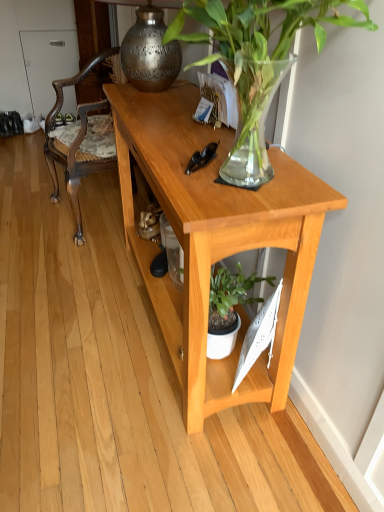
Question: Is green glossy plant at upper center completely or partially outside of polished brass lamp at upper center?

Choices:
 (A) yes
 (B) no

Answer: (A)

Question: Can you confirm if green glossy plant at upper center is positioned to the left of polished brass lamp at upper center?

Choices:
 (A) yes
 (B) no

Answer: (B)

Question: Does green glossy plant at upper center have a lesser width compared to polished brass lamp at upper center?

Choices:
 (A) no
 (B) yes

Answer: (A)

Question: Is green glossy plant at upper center looking in the opposite direction of polished brass lamp at upper center?

Choices:
 (A) yes
 (B) no

Answer: (B)

Question: Is polished brass lamp at upper center located within green glossy plant at upper center?

Choices:
 (A) yes
 (B) no

Answer: (B)

Question: From the image's perspective, is green glossy plant at upper center under polished brass lamp at upper center?

Choices:
 (A) no
 (B) yes

Answer: (B)

Question: From the image's perspective, is wooden carved chair at left under green glossy plant at upper center?

Choices:
 (A) yes
 (B) no

Answer: (B)

Question: Is the depth of wooden carved chair at left less than that of green glossy plant at upper center?

Choices:
 (A) no
 (B) yes

Answer: (A)

Question: Is wooden carved chair at left in contact with green glossy plant at upper center?

Choices:
 (A) yes
 (B) no

Answer: (B)

Question: Does wooden carved chair at left have a smaller size compared to green glossy plant at upper center?

Choices:
 (A) yes
 (B) no

Answer: (B)

Question: From a real-world perspective, is wooden carved chair at left on top of green glossy plant at upper center?

Choices:
 (A) no
 (B) yes

Answer: (A)

Question: From the image's perspective, does wooden carved chair at left appear higher than green glossy plant at upper center?

Choices:
 (A) yes
 (B) no

Answer: (A)

Question: Considering the relative sizes of light wood desk at center and wooden carved chair at left in the image provided, is light wood desk at center bigger than wooden carved chair at left?

Choices:
 (A) yes
 (B) no

Answer: (A)